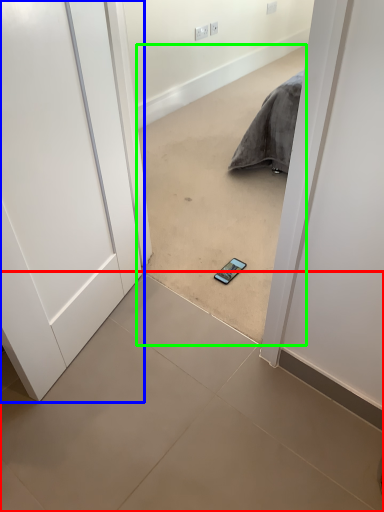
Question: Which is farther away from ceramic tile (highlighted by a red box)? door (highlighted by a blue box) or concrete (highlighted by a green box)?

Choices:
 (A) door
 (B) concrete

Answer: (B)